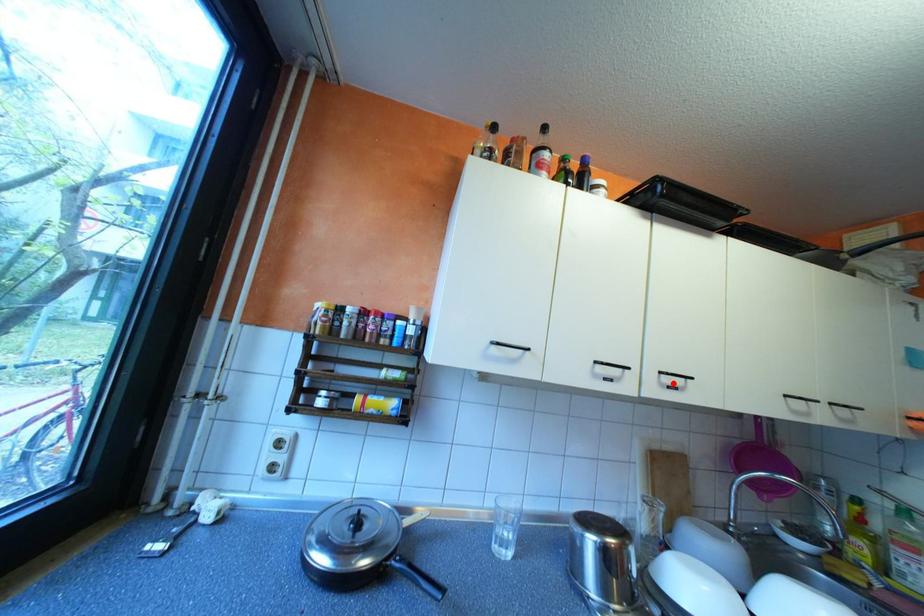
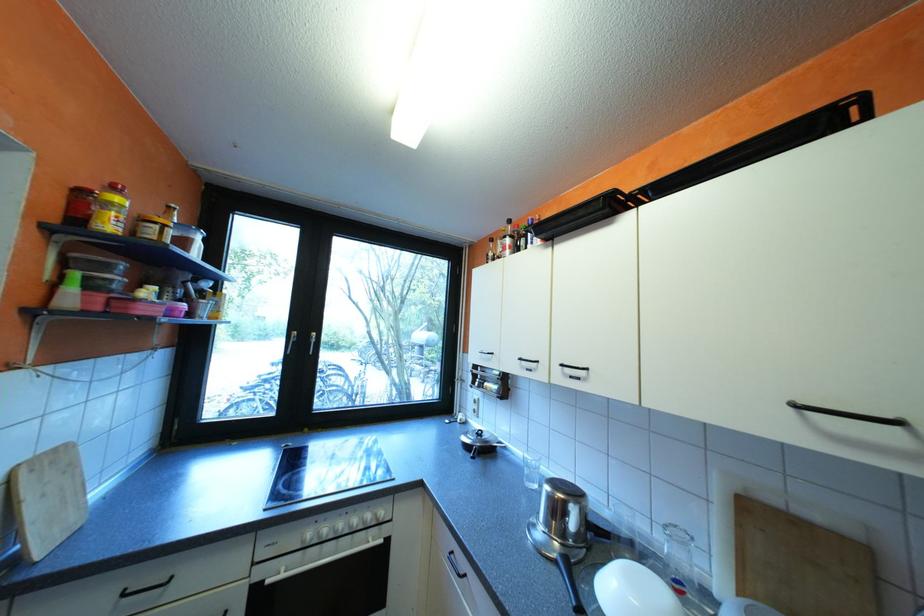
In the second image, find the point that corresponds to the highlighted location in the first image.

(576, 373)